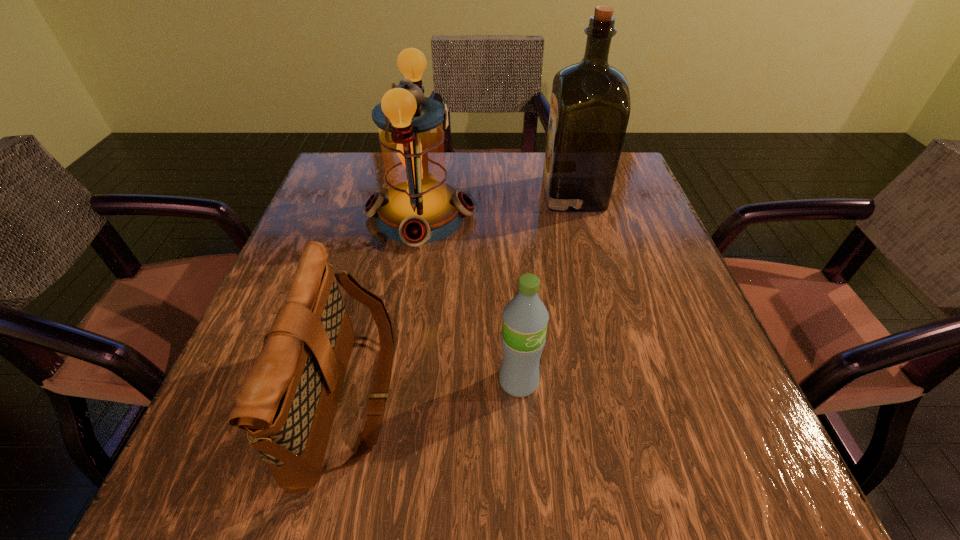
Identify the location of unoccupied position between the second tallest object and the second object from right to left. (469, 299).

Identify the location of free space between the tallest object and the lantern. (496, 205).

This screenshot has height=540, width=960. Identify the location of empty space between the liquor and the lantern. (496, 205).

You are a GUI agent. You are given a task and a screenshot of the screen. Output one action in this format:
    pyautogui.click(x=<x>, y=<y>)
    Task: Click on the free space between the shoulder bag and the liquor
    
    Given the screenshot: What is the action you would take?
    pyautogui.click(x=461, y=296)

Locate an element on the screen. The image size is (960, 540). empty space between the tallest object and the second tallest object is located at coordinates (496, 205).

Image resolution: width=960 pixels, height=540 pixels. I want to click on the closest object relative to the shoulder bag, so click(x=525, y=317).

Point out which object is positioned as the third nearest to the shoulder bag. Please provide its 2D coordinates. Your answer should be formatted as a tuple, i.e. [(x, y)], where the tuple contains the x and y coordinates of a point satisfying the conditions above.

[(590, 106)]

Locate an element on the screen. free location that satisfies the following two spatial constraints: 1. on the front-facing side of the lantern; 2. on the right side of the water bottle is located at coordinates (394, 382).

You are a GUI agent. You are given a task and a screenshot of the screen. Output one action in this format:
    pyautogui.click(x=<x>, y=<y>)
    Task: Click on the vacant space that satisfies the following two spatial constraints: 1. on the front-facing side of the lantern; 2. on the back side of the third object from left to right
    The width and height of the screenshot is (960, 540).
    Given the screenshot: What is the action you would take?
    [x=394, y=382]

Where is `free spot that satisfies the following two spatial constraints: 1. on the front-facing side of the lantern; 2. on the left side of the water bottle`? Image resolution: width=960 pixels, height=540 pixels. free spot that satisfies the following two spatial constraints: 1. on the front-facing side of the lantern; 2. on the left side of the water bottle is located at coordinates (394, 382).